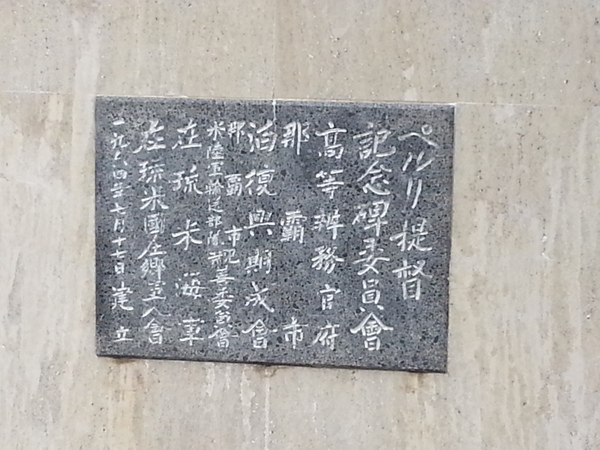
Locate an element on the screen. This screenshot has width=600, height=450. four beige tiles is located at coordinates (480, 390), (213, 405), (460, 68), (135, 54).